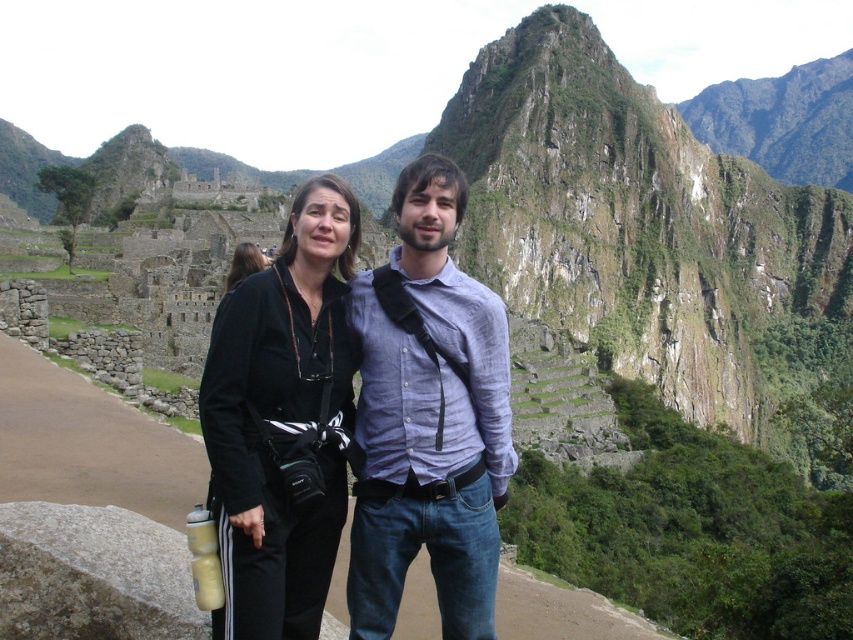
You are a photographer trying to capture a photo of the two tourists at Machu Picchu. You notice the black fabric jacket at center and the black fabric camera at center in your frame. Which object should you adjust to avoid blocking the other? Explain your reasoning.

The black fabric jacket at center is positioned under the black fabric camera at center. To avoid blocking the jacket, you should adjust the camera so it moves upward. Alternatively, to avoid blocking the camera, lower the jacket. Since adjusting the camera might be easier, moving the camera up would prevent it from overlapping the jacket below.

You are a photographer planning to take a group photo of the two people in the scene. You want to ensure that both the light blue linen shirt at center and the black fabric jacket at center are fully visible in the photo. Based on their heights, which clothing item will require you to adjust your camera angle upwards to capture its full length?

The black fabric jacket at center is taller than the light blue linen shirt at center, so you will need to adjust the camera angle upwards to capture its full length.